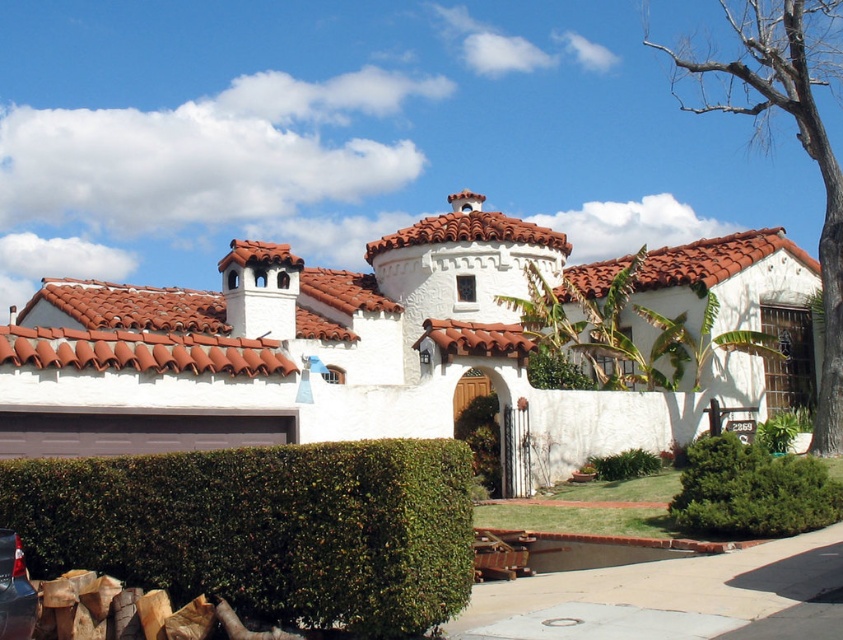
Question: Can you confirm if green leafy hedge at lower left is thinner than green leafy plant at center?

Choices:
 (A) no
 (B) yes

Answer: (B)

Question: Which of these objects is positioned farthest from the green leafy bush at lower right?

Choices:
 (A) green leafy bush at lower center
 (B) green leafy hedge at lower left

Answer: (B)

Question: Based on their relative distances, which object is farther from the green leafy bush at center?

Choices:
 (A) green leafy hedge at lower left
 (B) brown bark tree at right
 (C) terracotta tiles at center

Answer: (B)

Question: Can you confirm if green leafy bush at center is thinner than green leafy bush at lower center?

Choices:
 (A) yes
 (B) no

Answer: (A)

Question: Does terracotta tiles at center appear under green leafy bush at lower right?

Choices:
 (A) no
 (B) yes

Answer: (A)

Question: Which object is farther from the camera taking this photo?

Choices:
 (A) green leafy bush at center
 (B) green leafy bush at lower right

Answer: (A)